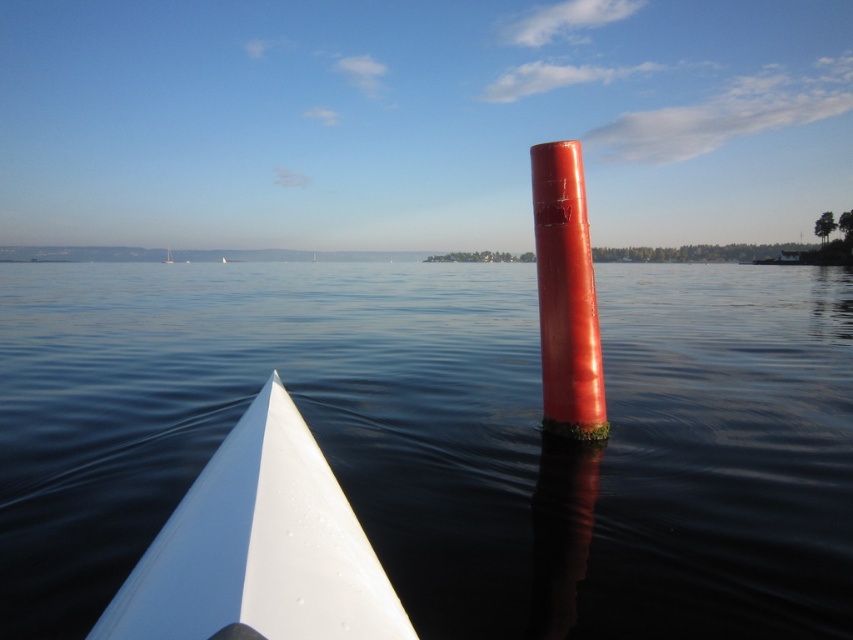
Describe the element at coordinates (259, 548) in the screenshot. I see `white glossy boat at lower left` at that location.

Which is behind, point (215, 477) or point (552, 211)?

Point (552, 211)

Is point (381, 572) positioned in front of point (554, 184)?

Yes, it is.

I want to click on white glossy boat at lower left, so tap(259, 548).

Is smooth water at center shorter than white glossy boat at lower left?

Incorrect, smooth water at center's height does not fall short of white glossy boat at lower left's.

Who is more forward, (392, 477) or (281, 460)?

Point (281, 460) is more forward.

Find the location of a particular element. smooth water at center is located at coordinates (448, 438).

Between smooth water at center and glossy red pole at center, which one has less height?

glossy red pole at center is shorter.

Identify the location of smooth water at center. The width and height of the screenshot is (853, 640). (448, 438).

Image resolution: width=853 pixels, height=640 pixels. Find the location of `smooth water at center`. smooth water at center is located at coordinates click(x=448, y=438).